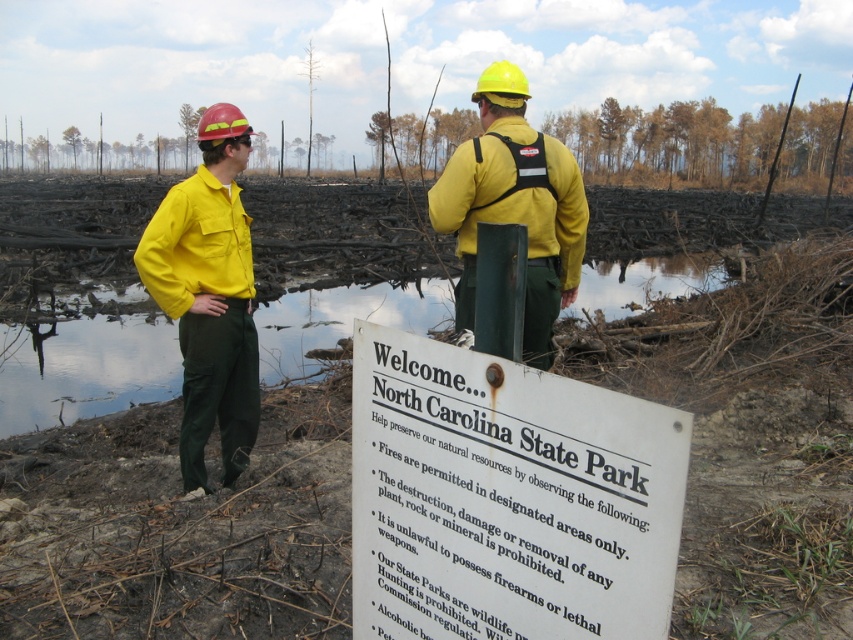
You are a visitor to the North Carolina State Park and see the white paper sign at center and the yellow matte vest at center. Which object is shorter in height?

The white paper sign at center is shorter in height compared to the yellow matte vest at center.

You are a park visitor who wants to read the signboard. You see the white paper sign at center and the yellow matte vest at center. Which object is closer to you?

The white paper sign at center is closer to you because it is in front of the yellow matte vest at center.